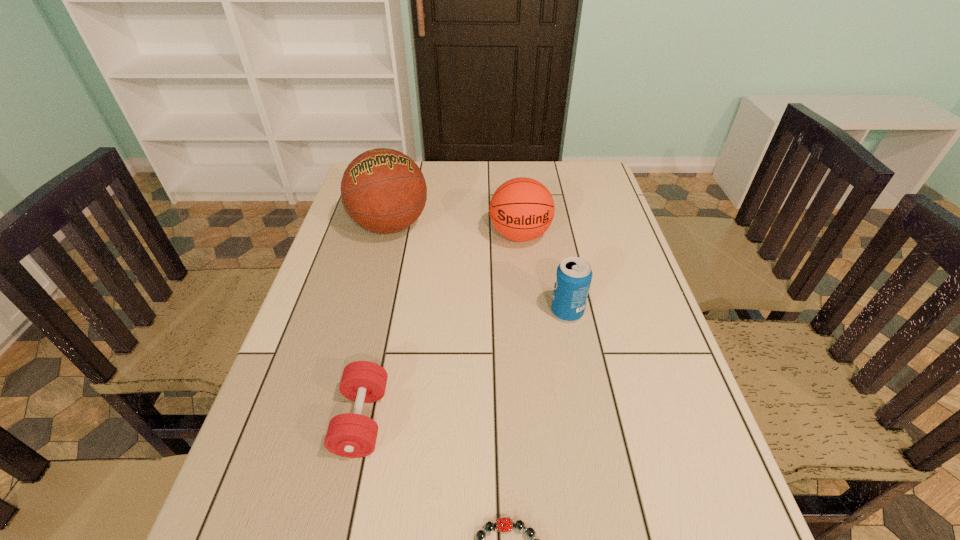
Find the location of a particular element. This screenshot has width=960, height=540. the tallest object is located at coordinates (384, 191).

You are a GUI agent. You are given a task and a screenshot of the screen. Output one action in this format:
    pyautogui.click(x=<x>, y=<y>)
    Task: Click on the taller basketball
    This screenshot has height=540, width=960.
    Given the screenshot: What is the action you would take?
    384,191

Find the location of a particular element. the right basketball is located at coordinates (521, 209).

The width and height of the screenshot is (960, 540). I want to click on the fourth shortest object, so click(521, 209).

Where is `the third nearest object`? Image resolution: width=960 pixels, height=540 pixels. the third nearest object is located at coordinates (573, 279).

Find the location of `the third shortest object`. the third shortest object is located at coordinates (573, 279).

Image resolution: width=960 pixels, height=540 pixels. I want to click on the fourth farthest object, so click(x=352, y=435).

In order to click on the fourth tallest object in this screenshot , I will do `click(352, 435)`.

This screenshot has width=960, height=540. What are the coordinates of `free space located on the right of the tallest object` in the screenshot? It's located at (475, 226).

The height and width of the screenshot is (540, 960). Identify the location of free space located on the side with logo of the fourth shortest object. tap(535, 372).